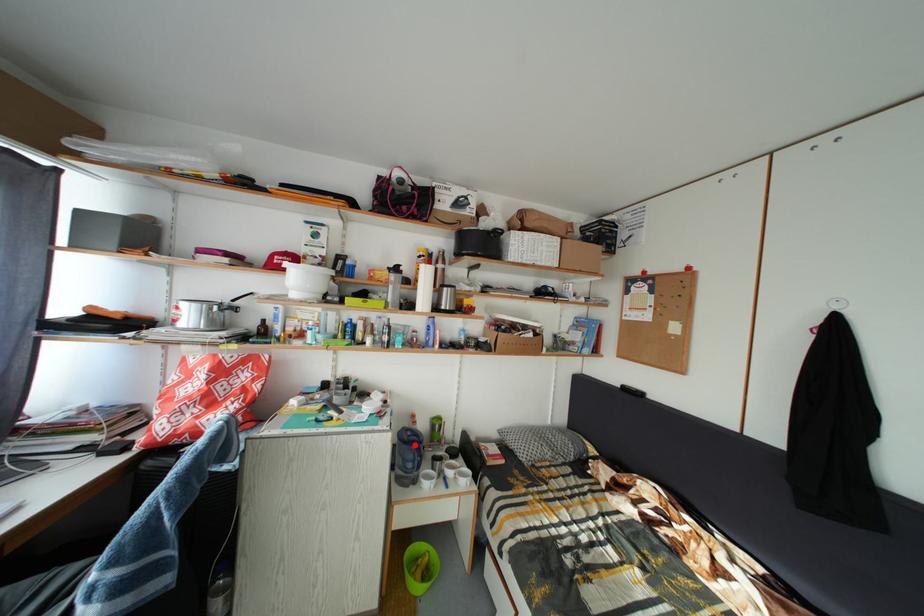
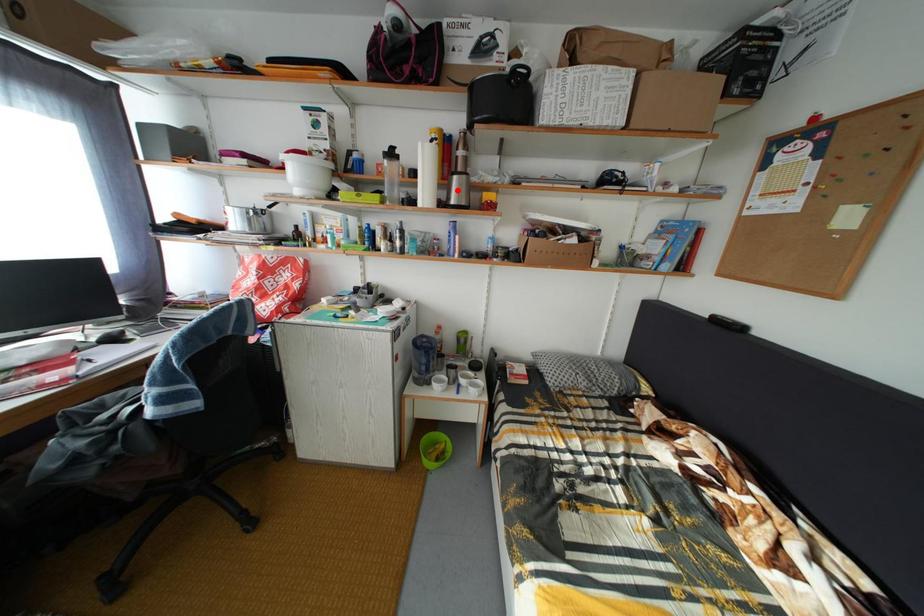
I am providing you with two images of the same scene from different viewpoints. A red point is marked on the first image and another point is marked on the second image. Is the red point in image1 aligned with the point shown in image2?

No